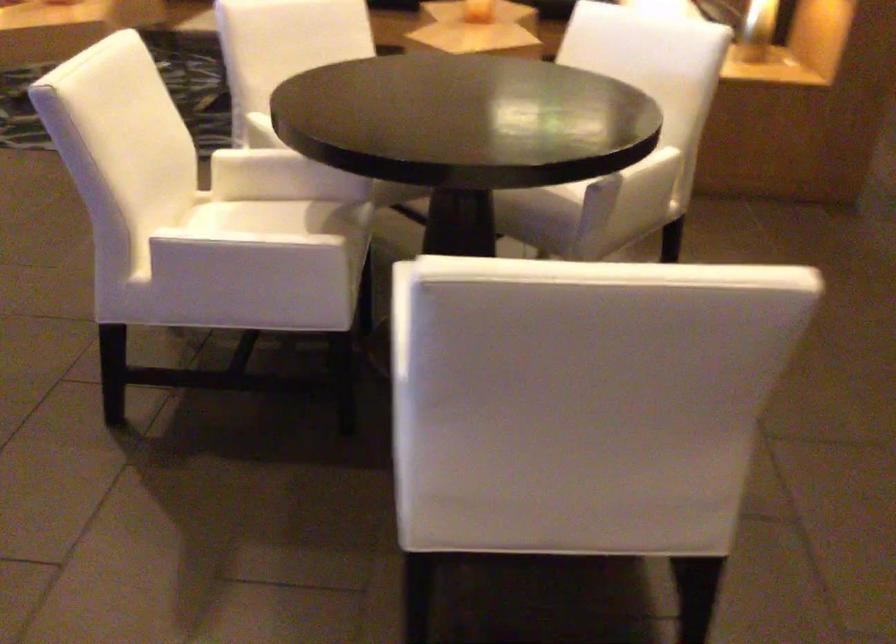
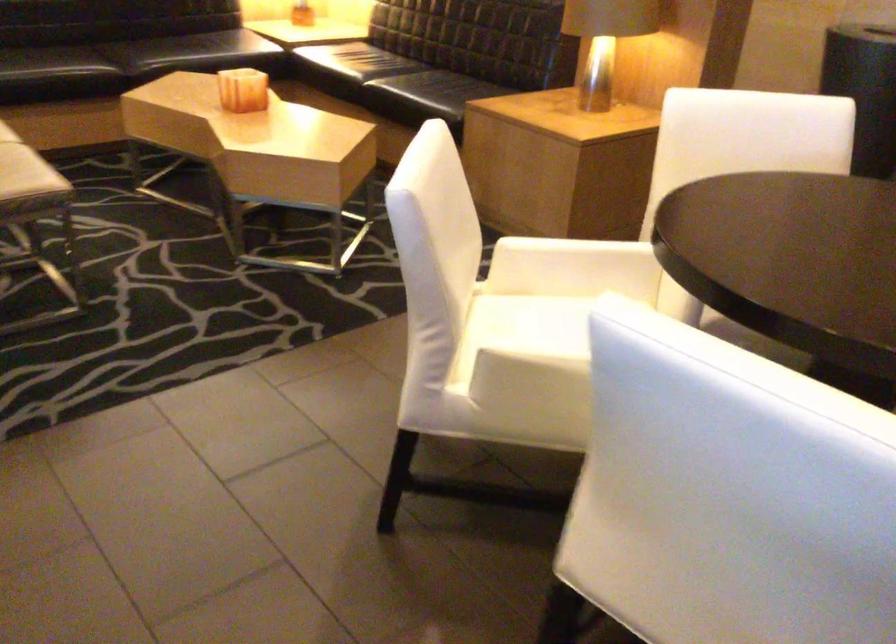
In the second image, find the point that corresponds to (x=255, y=126) in the first image.

(526, 366)